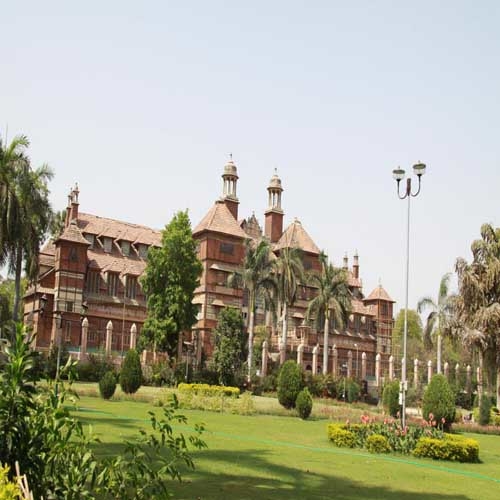
Identify the location of windows. The height and width of the screenshot is (500, 500). (114, 285), (130, 287), (93, 280), (230, 248), (380, 306).